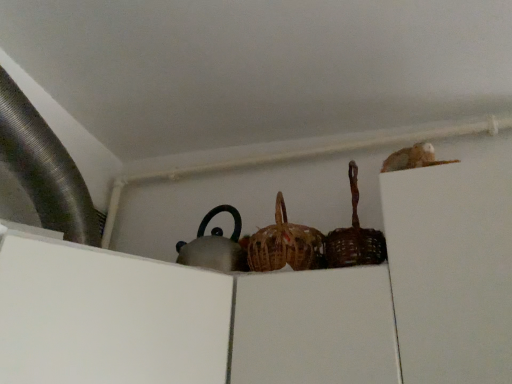
Describe the element at coordinates (284, 245) in the screenshot. The height and width of the screenshot is (384, 512). I see `woven brown basket at center, which is counted as the 1th basket, starting from the left` at that location.

You are a GUI agent. You are given a task and a screenshot of the screen. Output one action in this format:
    pyautogui.click(x=<x>, y=<y>)
    Task: Click on the woven brown basket at center, which is counted as the 1th basket, starting from the left
    
    Given the screenshot: What is the action you would take?
    pyautogui.click(x=284, y=245)

Image resolution: width=512 pixels, height=384 pixels. What do you see at coordinates (354, 237) in the screenshot? I see `brown woven basket at center, which appears as the 1th basket when viewed from the right` at bounding box center [354, 237].

This screenshot has height=384, width=512. I want to click on brown woven basket at center, which appears as the 1th basket when viewed from the right, so click(354, 237).

Find the location of a particular element. woven brown basket at center, which is counted as the 1th basket, starting from the left is located at coordinates (284, 245).

Between brown woven basket at center, which appears as the 1th basket when viewed from the right, and woven brown basket at center, which is counted as the second basket, starting from the right, which one appears on the right side from the viewer's perspective?

From the viewer's perspective, brown woven basket at center, which appears as the 1th basket when viewed from the right, appears more on the right side.

Is brown woven basket at center, which appears as the 1th basket when viewed from the right, positioned behind woven brown basket at center, which is counted as the second basket, starting from the right?

No, the depth of brown woven basket at center, which appears as the 1th basket when viewed from the right, is less than that of woven brown basket at center, which is counted as the second basket, starting from the right.

Considering the positions of points (358, 230) and (304, 260), is point (358, 230) farther from camera compared to point (304, 260)?

No, (358, 230) is closer to viewer.

Consider the image. From the image's perspective, between brown woven basket at center, the 2th basket positioned from the left, and woven brown basket at center, which is counted as the second basket, starting from the right, which one is located above?

From the image's view, brown woven basket at center, the 2th basket positioned from the left, is above.

From a real-world perspective, who is located higher, brown woven basket at center, which appears as the 1th basket when viewed from the right, or woven brown basket at center, which is counted as the 1th basket, starting from the left?

woven brown basket at center, which is counted as the 1th basket, starting from the left, is physically above.

Which of these two, brown woven basket at center, which appears as the 1th basket when viewed from the right, or woven brown basket at center, which is counted as the second basket, starting from the right, is thinner?

brown woven basket at center, which appears as the 1th basket when viewed from the right.

Between brown woven basket at center, the 2th basket positioned from the left, and woven brown basket at center, which is counted as the second basket, starting from the right, which one has more height?

woven brown basket at center, which is counted as the second basket, starting from the right.

Does brown woven basket at center, which appears as the 1th basket when viewed from the right, have a larger size compared to woven brown basket at center, which is counted as the 1th basket, starting from the left?

Incorrect, brown woven basket at center, which appears as the 1th basket when viewed from the right, is not larger than woven brown basket at center, which is counted as the 1th basket, starting from the left.

Looking at this image, is brown woven basket at center, which appears as the 1th basket when viewed from the right, inside or outside of woven brown basket at center, which is counted as the 1th basket, starting from the left?

brown woven basket at center, which appears as the 1th basket when viewed from the right, exists outside the volume of woven brown basket at center, which is counted as the 1th basket, starting from the left.

Is brown woven basket at center, the 2th basket positioned from the left, with woven brown basket at center, which is counted as the second basket, starting from the right?

Yes, brown woven basket at center, the 2th basket positioned from the left, is touching woven brown basket at center, which is counted as the second basket, starting from the right.

Does brown woven basket at center, which appears as the 1th basket when viewed from the right, turn towards woven brown basket at center, which is counted as the 1th basket, starting from the left?

No, brown woven basket at center, which appears as the 1th basket when viewed from the right, is not facing towards woven brown basket at center, which is counted as the 1th basket, starting from the left.

How much distance is there between brown woven basket at center, which appears as the 1th basket when viewed from the right, and woven brown basket at center, which is counted as the second basket, starting from the right?

brown woven basket at center, which appears as the 1th basket when viewed from the right, is 3.78 inches from woven brown basket at center, which is counted as the second basket, starting from the right.

At what (x,y) coordinates should I click in order to perform the action: click on basket above the brown woven basket at center, the 2th basket positioned from the left (from a real-world perspective). Please return your answer as a coordinate pair (x, y). Looking at the image, I should click on (284, 245).

Can you confirm if woven brown basket at center, which is counted as the 1th basket, starting from the left, is positioned to the right of brown woven basket at center, which appears as the 1th basket when viewed from the right?

In fact, woven brown basket at center, which is counted as the 1th basket, starting from the left, is to the left of brown woven basket at center, which appears as the 1th basket when viewed from the right.

Considering their positions, is woven brown basket at center, which is counted as the second basket, starting from the right, located in front of or behind brown woven basket at center, which appears as the 1th basket when viewed from the right?

woven brown basket at center, which is counted as the second basket, starting from the right, is positioned farther from the viewer than brown woven basket at center, which appears as the 1th basket when viewed from the right.

Between point (278, 203) and point (369, 238), which one is positioned behind?

The point (278, 203) is behind.

From the image's perspective, is woven brown basket at center, which is counted as the second basket, starting from the right, over brown woven basket at center, which appears as the 1th basket when viewed from the right?

Incorrect, from the image's perspective, woven brown basket at center, which is counted as the second basket, starting from the right, is lower than brown woven basket at center, which appears as the 1th basket when viewed from the right.

From a real-world perspective, is woven brown basket at center, which is counted as the second basket, starting from the right, over brown woven basket at center, the 2th basket positioned from the left?

Yes, from a real-world perspective, woven brown basket at center, which is counted as the second basket, starting from the right, is over brown woven basket at center, the 2th basket positioned from the left

Is woven brown basket at center, which is counted as the second basket, starting from the right, wider or thinner than brown woven basket at center, which appears as the 1th basket when viewed from the right?

In the image, woven brown basket at center, which is counted as the second basket, starting from the right, appears to be wider than brown woven basket at center, which appears as the 1th basket when viewed from the right.

From their relative heights in the image, would you say woven brown basket at center, which is counted as the second basket, starting from the right, is taller or shorter than brown woven basket at center, the 2th basket positioned from the left?

In the image, woven brown basket at center, which is counted as the second basket, starting from the right, appears to be taller than brown woven basket at center, the 2th basket positioned from the left.

Is woven brown basket at center, which is counted as the 1th basket, starting from the left, bigger than brown woven basket at center, the 2th basket positioned from the left?

Yes, woven brown basket at center, which is counted as the 1th basket, starting from the left, is bigger than brown woven basket at center, the 2th basket positioned from the left.

Is brown woven basket at center, the 2th basket positioned from the left, surrounded by woven brown basket at center, which is counted as the 1th basket, starting from the left?

No, brown woven basket at center, the 2th basket positioned from the left, is not a part of woven brown basket at center, which is counted as the 1th basket, starting from the left.

Is woven brown basket at center, which is counted as the second basket, starting from the right, not near brown woven basket at center, which appears as the 1th basket when viewed from the right?

No, woven brown basket at center, which is counted as the second basket, starting from the right, is not far from brown woven basket at center, which appears as the 1th basket when viewed from the right.

Could you tell me if woven brown basket at center, which is counted as the 1th basket, starting from the left, is facing brown woven basket at center, which appears as the 1th basket when viewed from the right?

No, woven brown basket at center, which is counted as the 1th basket, starting from the left, is not aimed at brown woven basket at center, which appears as the 1th basket when viewed from the right.

How many degrees apart are the facing directions of woven brown basket at center, which is counted as the 1th basket, starting from the left, and brown woven basket at center, which appears as the 1th basket when viewed from the right?

0.000135 degrees.

You are a GUI agent. You are given a task and a screenshot of the screen. Output one action in this format:
    pyautogui.click(x=<x>, y=<y>)
    Task: Click on the basket that appears above the brown woven basket at center, which appears as the 1th basket when viewed from the right (from a real-world perspective)
    Image resolution: width=512 pixels, height=384 pixels.
    Given the screenshot: What is the action you would take?
    pyautogui.click(x=284, y=245)

You are a GUI agent. You are given a task and a screenshot of the screen. Output one action in this format:
    pyautogui.click(x=<x>, y=<y>)
    Task: Click on the basket on the right of woven brown basket at center, which is counted as the second basket, starting from the right
    This screenshot has width=512, height=384.
    Given the screenshot: What is the action you would take?
    pyautogui.click(x=354, y=237)

Where is `basket on the left of the brown woven basket at center, the 2th basket positioned from the left`? basket on the left of the brown woven basket at center, the 2th basket positioned from the left is located at coordinates (284, 245).